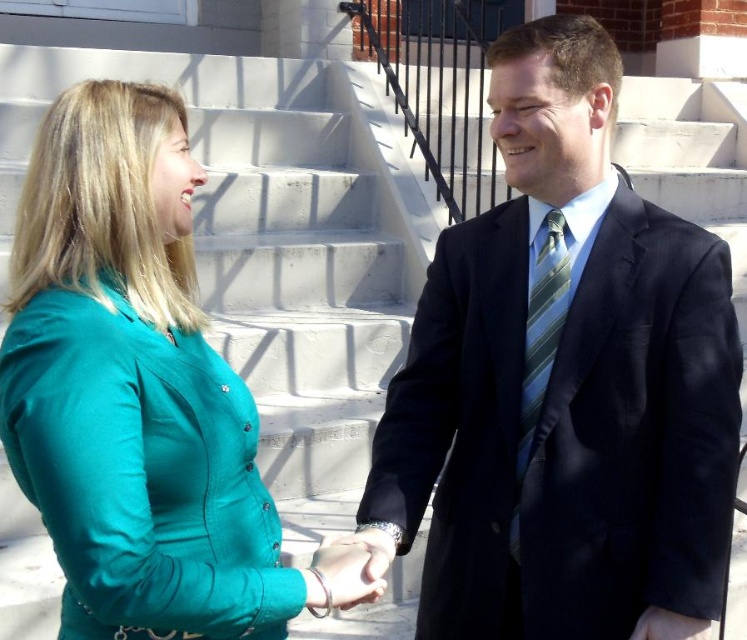
You are a photographer taking a picture of the two hands in the image. The teal fabric hand at center and the smooth black hand at center are overlapping. Which hand appears larger in the photo?

The teal fabric hand at center appears larger in the photo because it is much taller than the smooth black hand at center.

You are standing in front of the building and want to determine which of the two points, point (725, 268) or point (337, 589), is closer to you. Based on the scene, can you figure out which one is nearer?

Point (337, 589) is closer to you because it is less further to the camera than point (725, 268).

You are a photographer setting up a shot of the two people in the scene. You need to position a backdrop that is 1.2 meters wide. Considering the width of the matte black suit at center and the teal fabric blouse at left, will the backdrop fit comfortably between them?

The matte black suit at center might be wider than teal fabric blouse at left, so the backdrop may not fit comfortably between them if the combined width of both exceeds 1.2 meters. However, without exact measurements, it is uncertain.